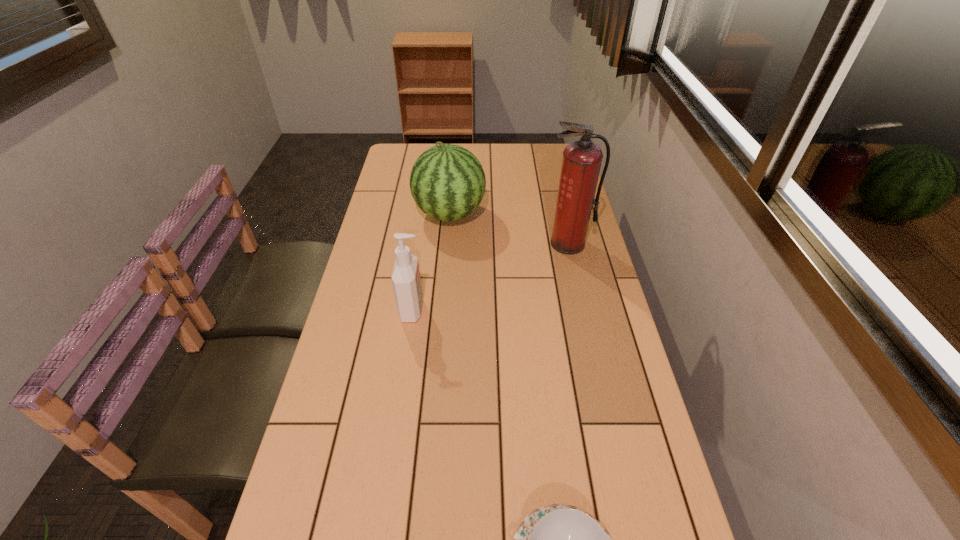
I want to click on fire extinguisher, so click(581, 162).

Where is `watermelon`? This screenshot has height=540, width=960. watermelon is located at coordinates click(447, 182).

You are a GUI agent. You are given a task and a screenshot of the screen. Output one action in this format:
    pyautogui.click(x=<x>, y=<y>)
    Task: Click on the cleansing agent
    The image size is (960, 540).
    Given the screenshot: What is the action you would take?
    pyautogui.click(x=406, y=281)

The height and width of the screenshot is (540, 960). Find the location of `free space located 0.270m at the nozzle of the fire extinguisher`. free space located 0.270m at the nozzle of the fire extinguisher is located at coordinates tap(586, 319).

Where is `vacant space situated 0.050m on the left of the watermelon`? vacant space situated 0.050m on the left of the watermelon is located at coordinates (399, 214).

Find the location of a particular element. This screenshot has width=960, height=540. vacant area located on the front label of the second nearest object is located at coordinates (541, 309).

Identify the location of watermelon that is at the left edge. (447, 182).

Where is `cleansing agent present at the left edge`? cleansing agent present at the left edge is located at coordinates (406, 281).

You are a GUI agent. You are given a task and a screenshot of the screen. Output one action in this format:
    pyautogui.click(x=<x>, y=<y>)
    Task: Click on the object that is at the right edge
    
    Given the screenshot: What is the action you would take?
    click(581, 162)

The width and height of the screenshot is (960, 540). Identify the location of free space at the far edge of the desktop. (515, 170).